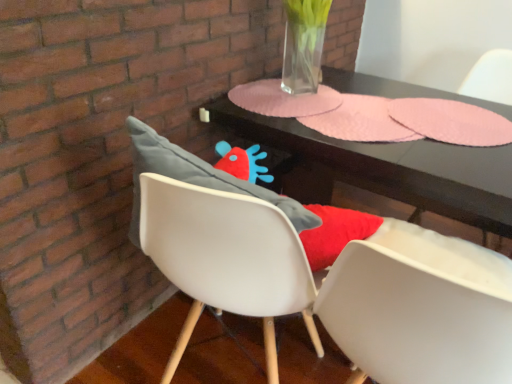
Question: From the image's perspective, is white matte armchair at upper right above matte gray cushion at center?

Choices:
 (A) no
 (B) yes

Answer: (B)

Question: Considering the relative positions of white matte armchair at upper right and matte gray cushion at center in the image provided, is white matte armchair at upper right behind matte gray cushion at center?

Choices:
 (A) yes
 (B) no

Answer: (A)

Question: Is white matte armchair at upper right bigger than matte gray cushion at center?

Choices:
 (A) yes
 (B) no

Answer: (B)

Question: Considering the relative sizes of white matte armchair at upper right and matte gray cushion at center in the image provided, is white matte armchair at upper right taller than matte gray cushion at center?

Choices:
 (A) yes
 (B) no

Answer: (A)

Question: Is white matte armchair at upper right outside of matte gray cushion at center?

Choices:
 (A) no
 (B) yes

Answer: (B)

Question: Is white matte armchair at upper right wider or thinner than matte gray cushion at center?

Choices:
 (A) wide
 (B) thin

Answer: (B)

Question: From the image's perspective, is white matte armchair at upper right located above or below matte gray cushion at center?

Choices:
 (A) above
 (B) below

Answer: (A)

Question: Considering the positions of white matte armchair at upper right and matte gray cushion at center in the image, is white matte armchair at upper right taller or shorter than matte gray cushion at center?

Choices:
 (A) tall
 (B) short

Answer: (A)

Question: Would you say white matte armchair at upper right is to the left or to the right of matte gray cushion at center in the picture?

Choices:
 (A) left
 (B) right

Answer: (B)

Question: Is matte gray cushion at center bigger or smaller than pink paper placemats at center?

Choices:
 (A) big
 (B) small

Answer: (A)

Question: From the image's perspective, is matte gray cushion at center located above or below pink paper placemats at center?

Choices:
 (A) below
 (B) above

Answer: (A)

Question: Visually, is matte gray cushion at center positioned to the left or to the right of pink paper placemats at center?

Choices:
 (A) right
 (B) left

Answer: (A)

Question: From a real-world perspective, is matte gray cushion at center physically located above or below pink paper placemats at center?

Choices:
 (A) below
 (B) above

Answer: (A)

Question: In the image, is pink paper placemats at center positioned in front of or behind matte gray cushion at center?

Choices:
 (A) behind
 (B) front

Answer: (A)

Question: From the image's perspective, is pink paper placemats at center above or below matte gray cushion at center?

Choices:
 (A) below
 (B) above

Answer: (B)